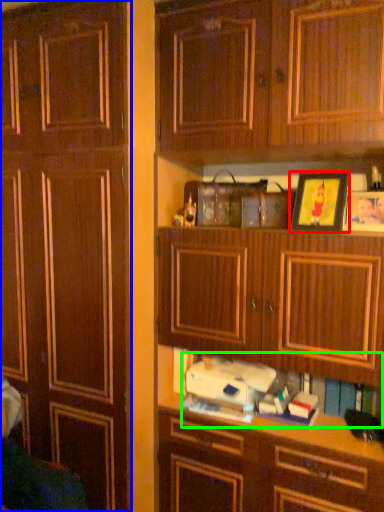
Question: Which object is the closest to the picture frame (highlighted by a red box)? Choose among these: cabinetry (highlighted by a blue box) or book (highlighted by a green box).

Choices:
 (A) cabinetry
 (B) book

Answer: (B)